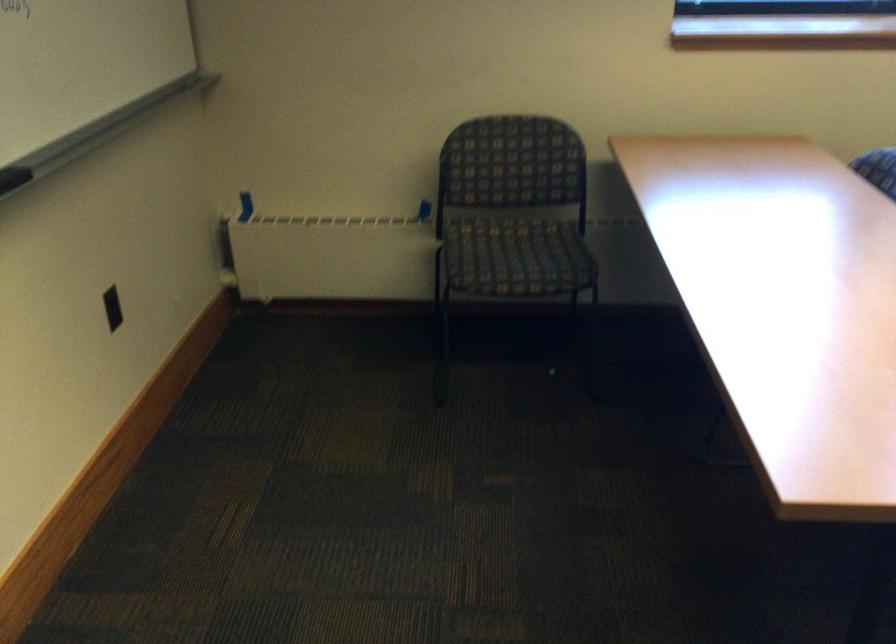
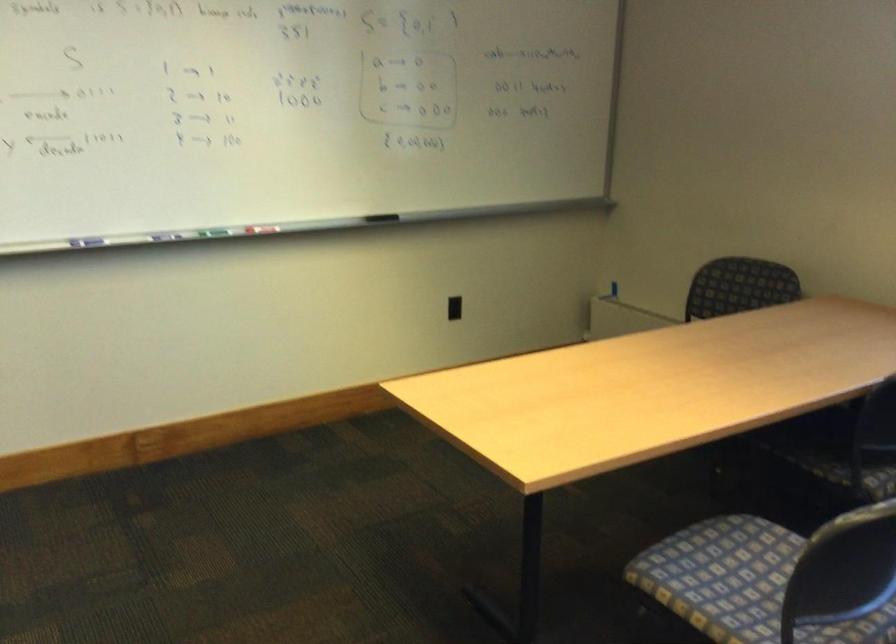
Where in the second image is the point corresponding to the point at 138,307 from the first image?

(453, 308)